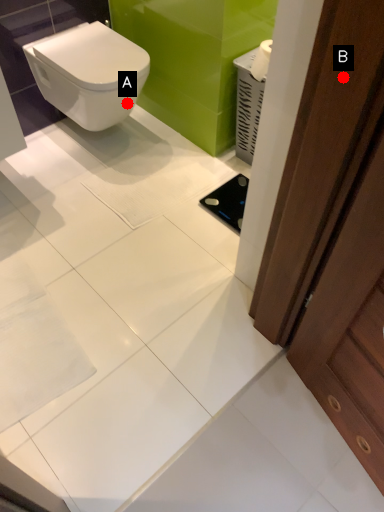
Question: Two points are circled on the image, labeled by A and B beside each circle. Which point is closer to the camera taking this photo?

Choices:
 (A) A is closer
 (B) B is closer

Answer: (B)